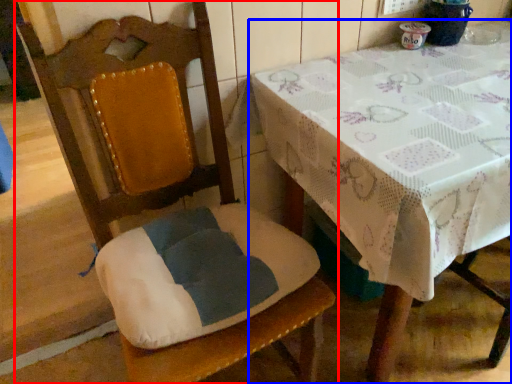
Question: Which point is closer to the camera, chair (highlighted by a red box) or table (highlighted by a blue box)?

Choices:
 (A) chair
 (B) table

Answer: (A)